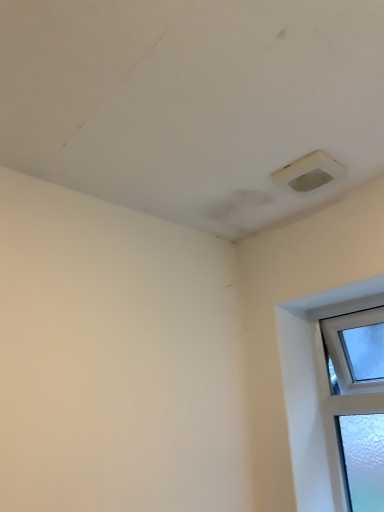
Question: Considering the positions of white plastic air conditioning at upper right and clear glass window at lower right in the image, is white plastic air conditioning at upper right wider or thinner than clear glass window at lower right?

Choices:
 (A) thin
 (B) wide

Answer: (B)

Question: From the image's perspective, relative to clear glass window at lower right, is white plastic air conditioning at upper right above or below?

Choices:
 (A) below
 (B) above

Answer: (B)

Question: Relative to clear glass window at lower right, is white plastic air conditioning at upper right in front or behind?

Choices:
 (A) front
 (B) behind

Answer: (A)

Question: Would you say clear glass window at lower right is to the left or to the right of white plastic air conditioning at upper right in the picture?

Choices:
 (A) left
 (B) right

Answer: (B)

Question: Considering the positions of clear glass window at lower right and white plastic air conditioning at upper right in the image, is clear glass window at lower right taller or shorter than white plastic air conditioning at upper right?

Choices:
 (A) short
 (B) tall

Answer: (B)

Question: Choose the correct answer: Is clear glass window at lower right inside white plastic air conditioning at upper right or outside it?

Choices:
 (A) outside
 (B) inside

Answer: (A)

Question: From the image's perspective, is clear glass window at lower right above or below white plastic air conditioning at upper right?

Choices:
 (A) below
 (B) above

Answer: (A)